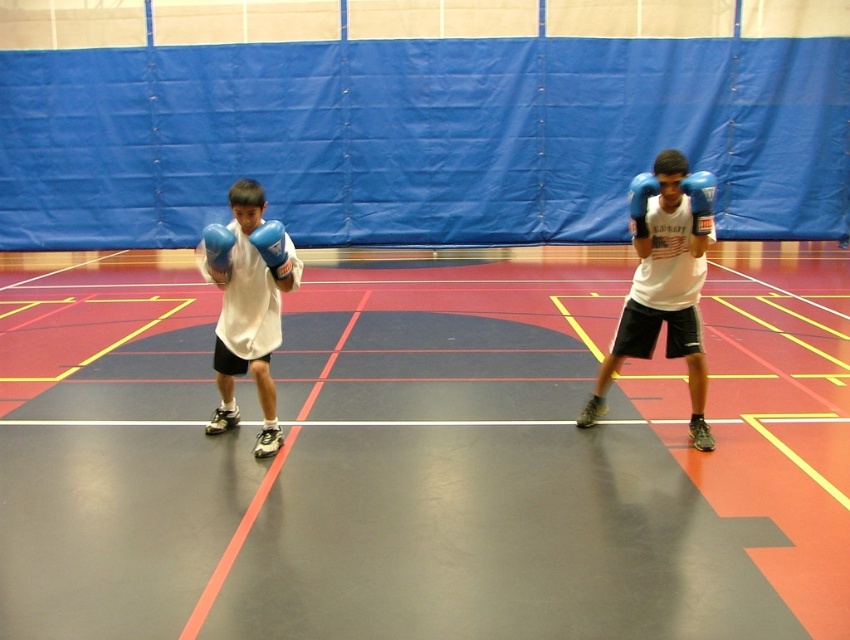
You are a boxing trainer observing the two blue matte boxing gloves in the image. The gymnasium has a rule that requires at least 30 centimeters of space between any two pieces of equipment for safety. Is the distance between the blue matte boxing glove at upper center and the blue matte boxing glove at left compliant with this rule?

The distance between the blue matte boxing glove at upper center and the blue matte boxing glove at left is 29.13 centimeters, which is less than the required 30 centimeters. Therefore, it does not comply with the gymnasium safety rule.

You are a gym trainer assessing the equipment. You see the white matte shirt at left and the blue matte boxing glove at upper center. Which object has a greater width?

The white matte shirt at left has a greater width than the blue matte boxing glove at upper center.